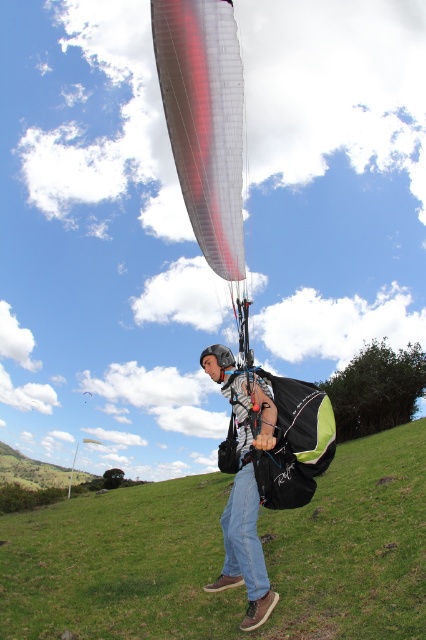
You are an aviation safety inspector reviewing this paraglider setup. You notice the red translucent fabric parachute at center and the denim jeans at center. Based on their sizes, which one is more likely to be the correct size for safe flight?

The red translucent fabric parachute at center has a larger size compared to denim jeans at center, so the parachute is the correct size for safe flight as it needs to be significantly larger than the person wearing the denim jeans at center.

You are a paraglider pilot preparing to land. You see the green grassy field at lower center and the denim jeans at center. Which object is located lower in the image?

The green grassy field at lower center is located below the denim jeans at center.